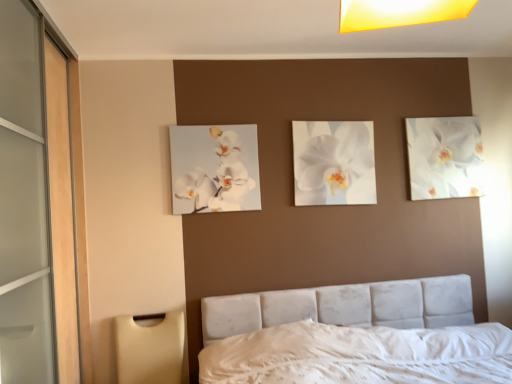
Question: In terms of height, does white glossy orchid at upper left, the 1th flower viewed from the left, look taller or shorter compared to white glossy orchid at center, acting as the second flower starting from the back?

Choices:
 (A) short
 (B) tall

Answer: (A)

Question: In the image, is white glossy orchid at upper left, arranged as the 3th flower when viewed from the right, positioned in front of or behind white glossy orchid at center, placed as the 2th flower when sorted from right to left?

Choices:
 (A) behind
 (B) front

Answer: (B)

Question: Which object is the farthest from the white glossy orchid at upper left, which appears as the first flower when viewed from the front?

Choices:
 (A) white glossy orchid at center, acting as the second flower starting from the back
 (B) beige plastic lampshade at lower left
 (C) white glossy orchid at upper right, the 1th flower in the back-to-front sequence
 (D) velvet white bed at center

Answer: (C)

Question: Considering the real-world distances, which object is closest to the beige plastic lampshade at lower left?

Choices:
 (A) velvet white bed at center
 (B) white glossy orchid at upper left, positioned as the 3th flower in back-to-front order
 (C) white glossy orchid at center, acting as the second flower starting from the back
 (D) white glossy orchid at upper right, the 1th flower in the back-to-front sequence

Answer: (A)